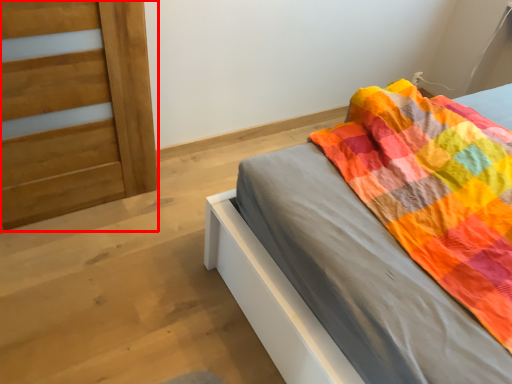
Question: Considering the relative positions of door (annotated by the red box) and bed in the image provided, where is door (annotated by the red box) located with respect to the staircase?

Choices:
 (A) left
 (B) right

Answer: (A)